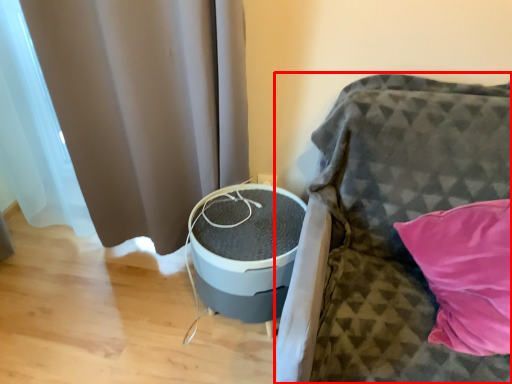
Question: From the image's perspective, where is furniture (annotated by the red box) located relative to curtain?

Choices:
 (A) below
 (B) above

Answer: (A)